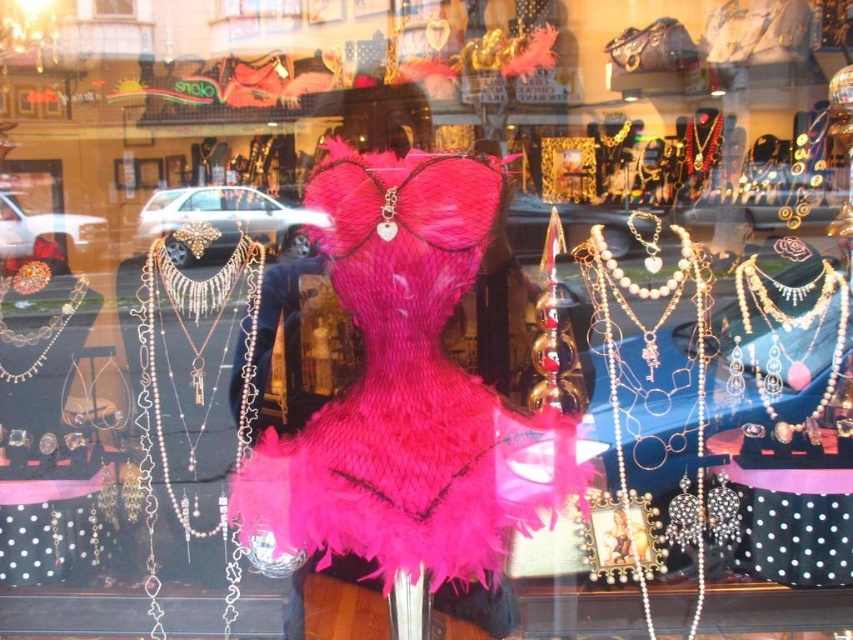
Does pearl/pearly white necklace at center right appear on the left side of silver metallic chain at left?

No, pearl/pearly white necklace at center right is not to the left of silver metallic chain at left.

Can you confirm if pearl/pearly white necklace at center right is shorter than silver metallic chain at left?

In fact, pearl/pearly white necklace at center right may be taller than silver metallic chain at left.

Is point (842, 291) positioned in front of point (44, 348)?

Yes, it is.

What are the coordinates of `pearl/pearly white necklace at center right` in the screenshot? It's located at (799, 316).

Does fuzzy pink dress at center appear under pearl/textured necklace at left?

No, fuzzy pink dress at center is not below pearl/textured necklace at left.

You are a GUI agent. You are given a task and a screenshot of the screen. Output one action in this format:
    pyautogui.click(x=<x>, y=<y>)
    Task: Click on the fuzzy pink dress at center
    
    Given the screenshot: What is the action you would take?
    pyautogui.click(x=407, y=392)

Does pearl/textured necklace at left appear on the right side of pearl/pearly white necklace at center right?

In fact, pearl/textured necklace at left is to the left of pearl/pearly white necklace at center right.

Is point (252, 252) positioned after point (811, 419)?

Yes, it is.

At what (x,y) coordinates should I click in order to perform the action: click on pearl/textured necklace at left. Please return your answer as a coordinate pair (x, y). The width and height of the screenshot is (853, 640). Looking at the image, I should click on (187, 332).